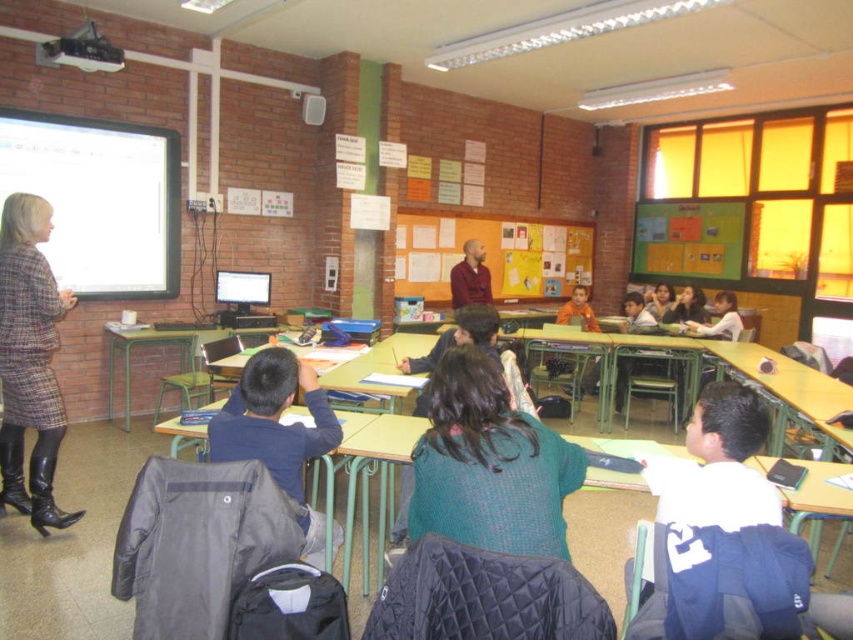
Question: Which point is farther to the camera?

Choices:
 (A) yellow paperboard at center
 (B) green wooden desk at center
 (C) wooden desk at lower right

Answer: (A)

Question: Among these objects, which one is nearest to the camera?

Choices:
 (A) green knitted sweater at center
 (B) plaid fabric coat at left
 (C) wooden desk at lower right

Answer: (A)

Question: Can you confirm if dark blue shirt at center is positioned above green plastic table at center?

Choices:
 (A) no
 (B) yes

Answer: (A)

Question: Does yellow paperboard at center have a greater width compared to brown shirt at center?

Choices:
 (A) no
 (B) yes

Answer: (B)

Question: Which object is farther from the camera taking this photo?

Choices:
 (A) green wooden desk at center
 (B) yellow paperboard at center
 (C) green knitted sweater at center
 (D) wooden desk at lower right

Answer: (B)

Question: Can you confirm if plaid fabric coat at left is bigger than yellow paperboard at center?

Choices:
 (A) yes
 (B) no

Answer: (B)